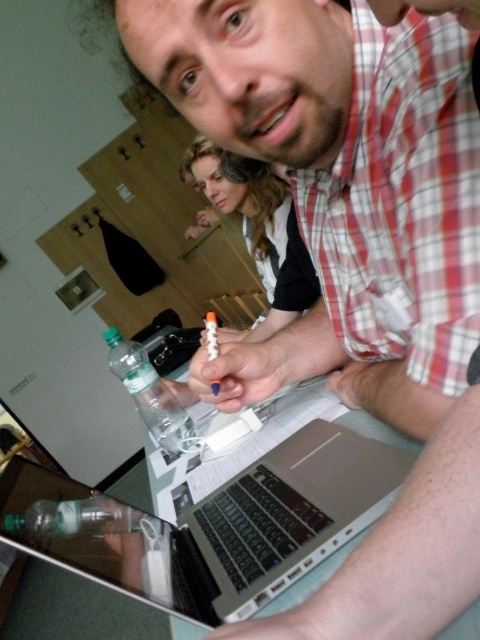
Is silver metallic laptop at center to the left of clear plastic bottle at lower left from the viewer's perspective?

In fact, silver metallic laptop at center is to the right of clear plastic bottle at lower left.

Is silver metallic laptop at center taller than clear plastic bottle at lower left?

Indeed, silver metallic laptop at center has a greater height compared to clear plastic bottle at lower left.

Find the location of a particular element. silver metallic laptop at center is located at coordinates (212, 524).

Who is taller, clear plastic bottle at lower left or translucent plastic pen at center?

translucent plastic pen at center

This screenshot has height=640, width=480. In order to click on clear plastic bottle at lower left in this screenshot , I will do `click(79, 518)`.

The image size is (480, 640). In order to click on clear plastic bottle at lower left in this screenshot , I will do `click(79, 518)`.

Which is above, silver metallic laptop at center or clear plastic bottle at center?

clear plastic bottle at center is higher up.

Is silver metallic laptop at center above clear plastic bottle at center?

No, silver metallic laptop at center is not above clear plastic bottle at center.

Locate an element on the screen. This screenshot has height=640, width=480. silver metallic laptop at center is located at coordinates (212, 524).